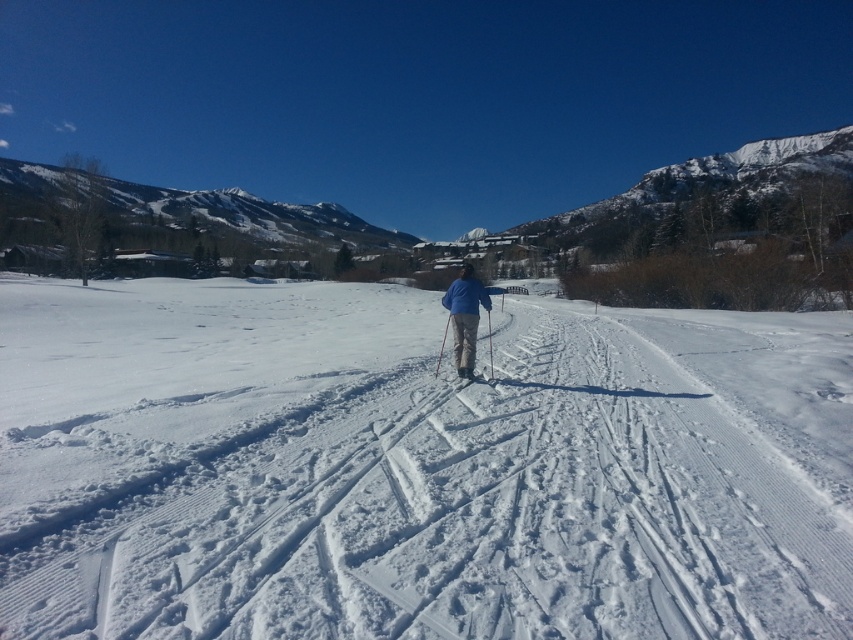
Question: Which object is farther from the camera taking this photo?

Choices:
 (A) white textured snow at center
 (B) blue fabric jacket at center
 (C) matte black ski pole at center
 (D) matte black ski at center

Answer: (C)

Question: Does matte black ski at center have a smaller size compared to matte black ski pole at center?

Choices:
 (A) no
 (B) yes

Answer: (B)

Question: Which of the following is the farthest from the observer?

Choices:
 (A) matte black ski pole at center
 (B) white textured snow at center
 (C) matte black ski at center

Answer: (A)

Question: Among these points, which one is nearest to the camera?

Choices:
 (A) click(x=457, y=387)
 (B) click(x=459, y=288)
 (C) click(x=490, y=339)
 (D) click(x=131, y=417)

Answer: (D)

Question: Is white textured snow at center positioned in front of matte black ski pole at center?

Choices:
 (A) yes
 (B) no

Answer: (A)

Question: In this image, where is white textured snow at center located relative to blue fabric jacket at center?

Choices:
 (A) above
 (B) below

Answer: (A)